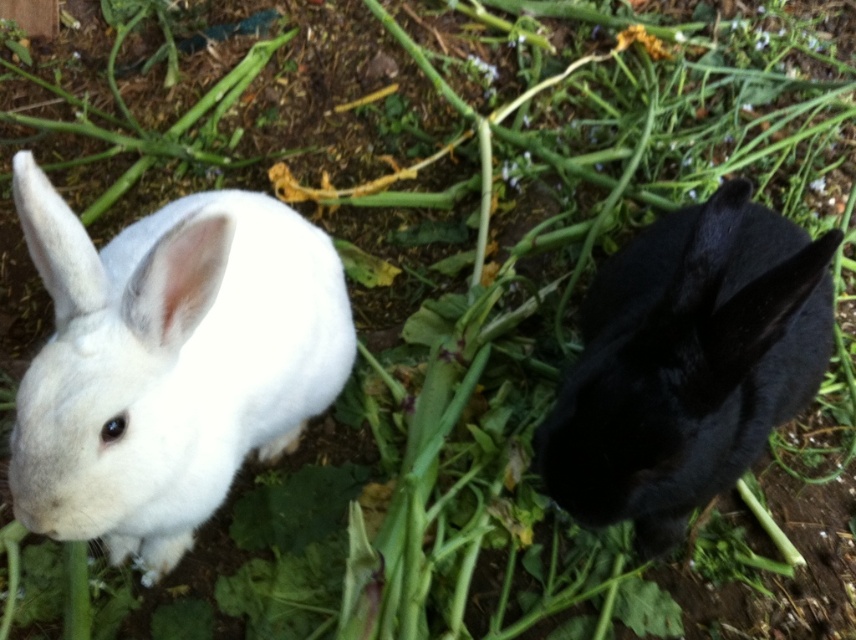
You are standing at the origin point in the garden scene. There is a point marked at coordinates point (168, 364). Which object is located at this point?

The point (168, 364) corresponds to the white fluffy rabbit at left.

You are a gardener trying to place a small fence between the white fluffy rabbit at left and the black matte rabbit at right to separate them. Based on their sizes, which rabbit will have more space between them and the fence if the fence is placed exactly halfway between them?

The white fluffy rabbit at left has a lesser width compared to the black matte rabbit at right. Therefore, if the fence is placed exactly halfway between them, the white fluffy rabbit at left will have more space between itself and the fence because it is smaller in width than the black matte rabbit at right.

You are standing in the garden where the two rabbits are. You want to place a small treat exactly at point (280, 244). If you are 1.5 meters tall, can you see the treat once it is placed there?

The distance of point (280, 244) from the viewer is 1.41 meters. Since the treat is placed at this point, which is closer than your height of 1.5 meters, you can see the treat once it is placed there.